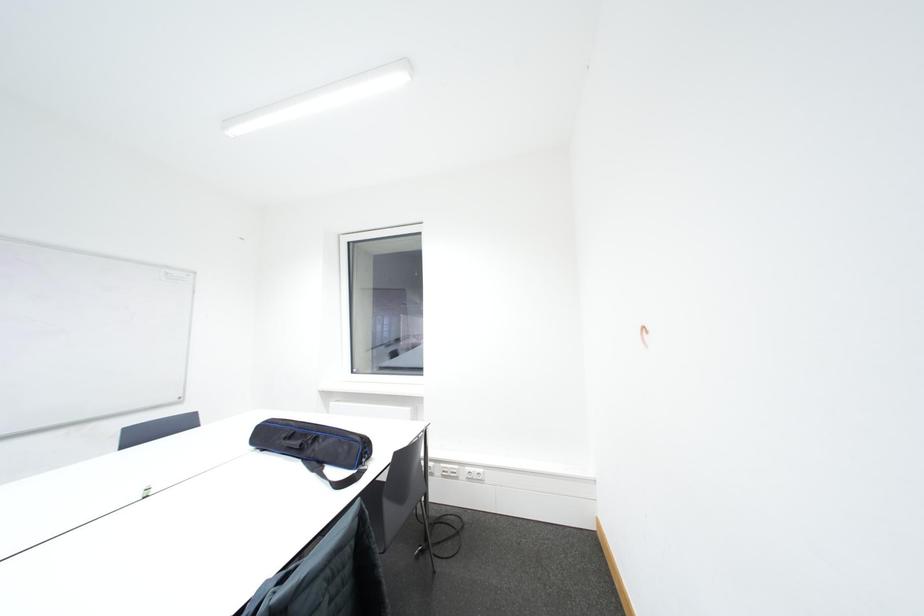
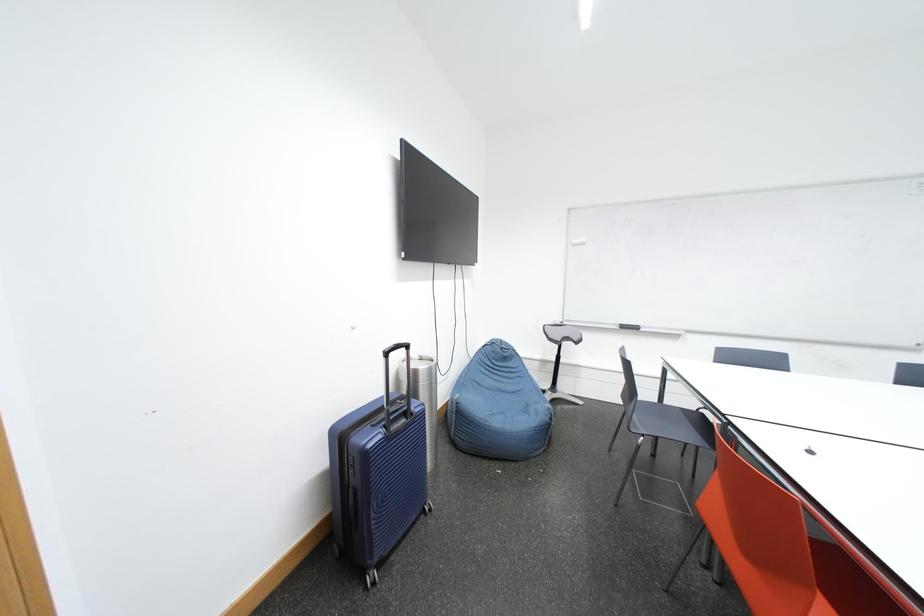
Question: How did the camera likely rotate?

Choices:
 (A) Left
 (B) Right
 (C) Up
 (D) Down

Answer: (A)